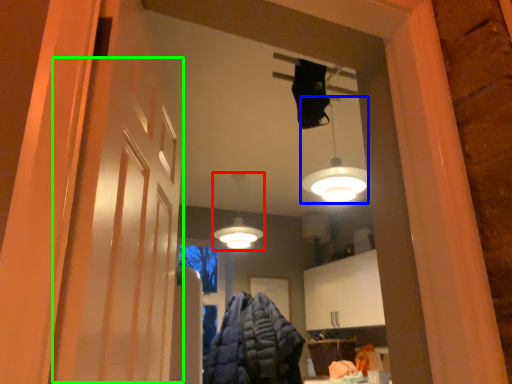
Question: Which is farther away from lamp (highlighted by a red box)? lamp (highlighted by a blue box) or barn door (highlighted by a green box)?

Choices:
 (A) lamp
 (B) barn door

Answer: (B)